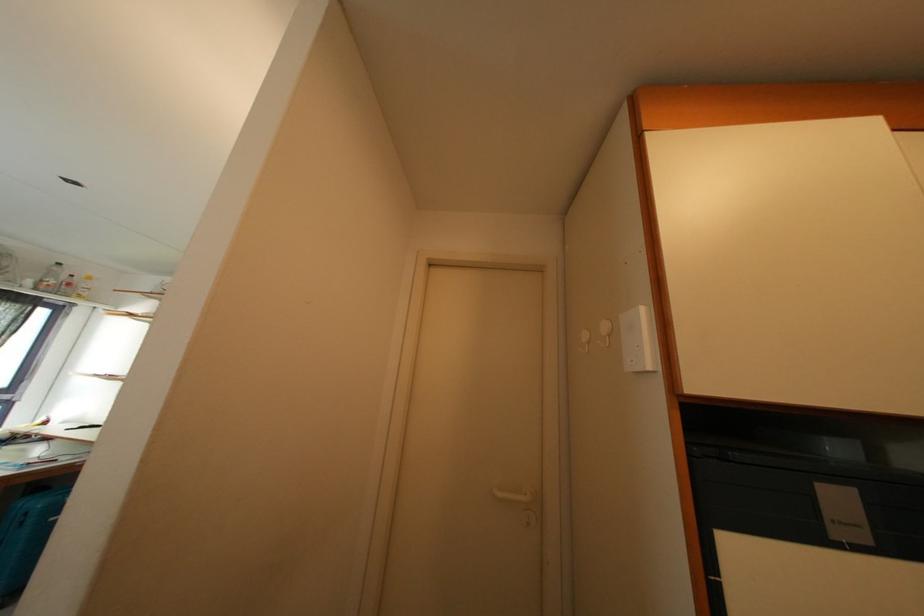
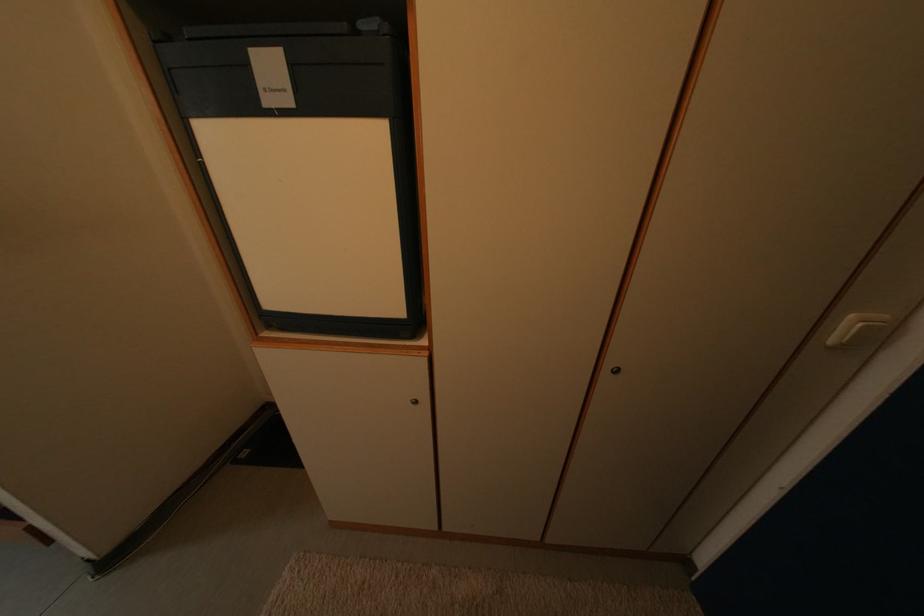
Question: The images are taken continuously from a first-person perspective. In which direction is your viewpoint rotating?

Choices:
 (A) Left
 (B) Right
 (C) Up
 (D) Down

Answer: (D)